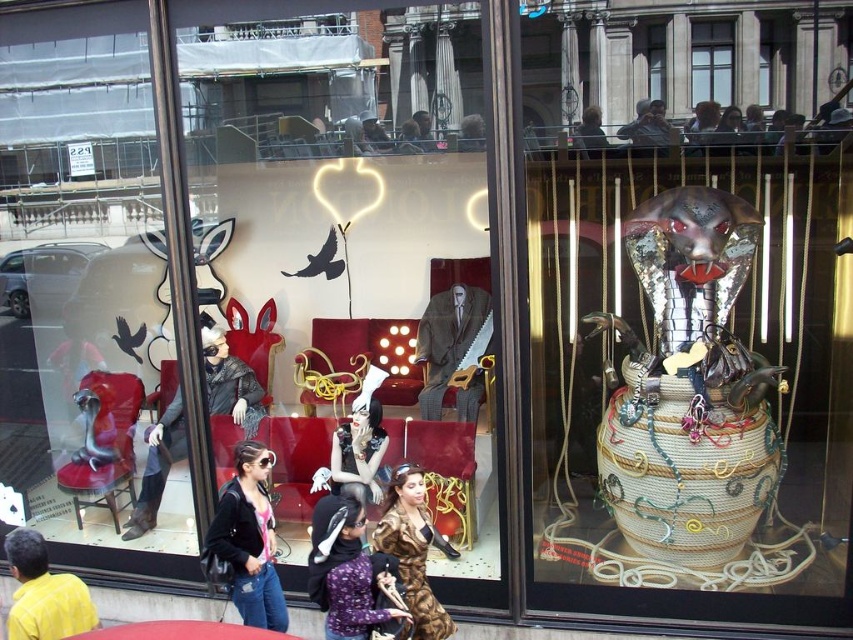
You are a customer standing in front of the storefront window. You see the leopard print dress at center. Can you determine its exact location within the window display?

The leopard print dress at center is located at the coordinates point (412,548) within the window display.

You are a customer looking at the storefront window display. You see the printed silk blouse at center and the leopard print dress at center. Which item is closer to you?

The printed silk blouse at center is closer to you because it is in front of the leopard print dress at center.